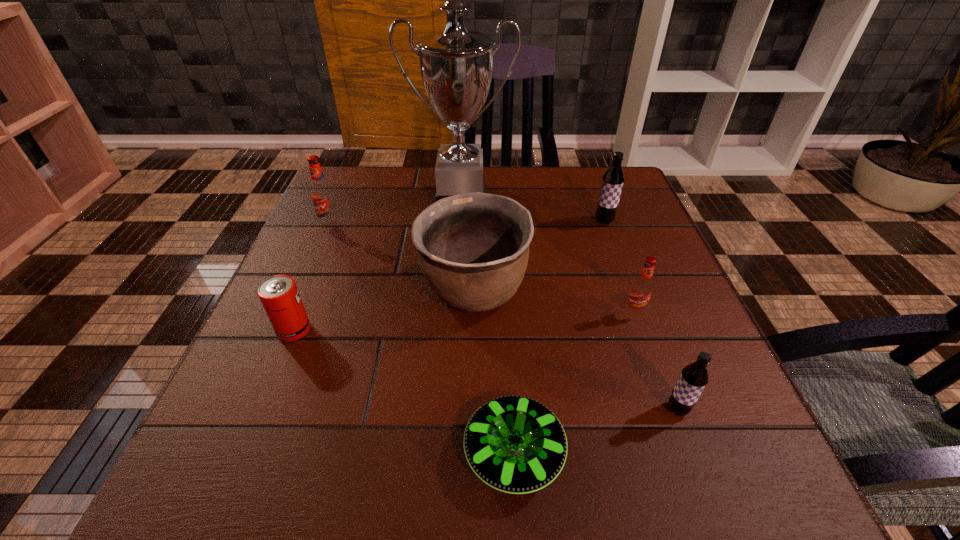
Image resolution: width=960 pixels, height=540 pixels. I want to click on object present at the far edge, so click(x=456, y=65).

Locate an element on the screen. object present at the near edge is located at coordinates (514, 444).

Image resolution: width=960 pixels, height=540 pixels. Find the location of `root beer that is at the left edge`. root beer that is at the left edge is located at coordinates (322, 195).

Where is `can that is at the left edge`? The image size is (960, 540). can that is at the left edge is located at coordinates (279, 295).

At what (x,y) coordinates should I click in order to perform the action: click on blank area at the far edge. Please return your answer as a coordinate pair (x, y). This screenshot has height=540, width=960. Looking at the image, I should click on (426, 186).

I want to click on vacant space at the left edge of the desktop, so click(x=302, y=278).

In the image, there is a desktop. At what (x,y) coordinates should I click in order to perform the action: click on vacant space at the right edge. Please return your answer as a coordinate pair (x, y). This screenshot has height=540, width=960. Looking at the image, I should click on (635, 246).

At what (x,y) coordinates should I click in order to perform the action: click on vacant space at the far right corner. Please return your answer as a coordinate pair (x, y). Looking at the image, I should click on (596, 192).

Identify the location of unoccupied position between the nearer red root beer and the pottery. (554, 301).

This screenshot has width=960, height=540. In order to click on unoccupied area between the can and the third farthest root beer in this screenshot , I will do `click(464, 321)`.